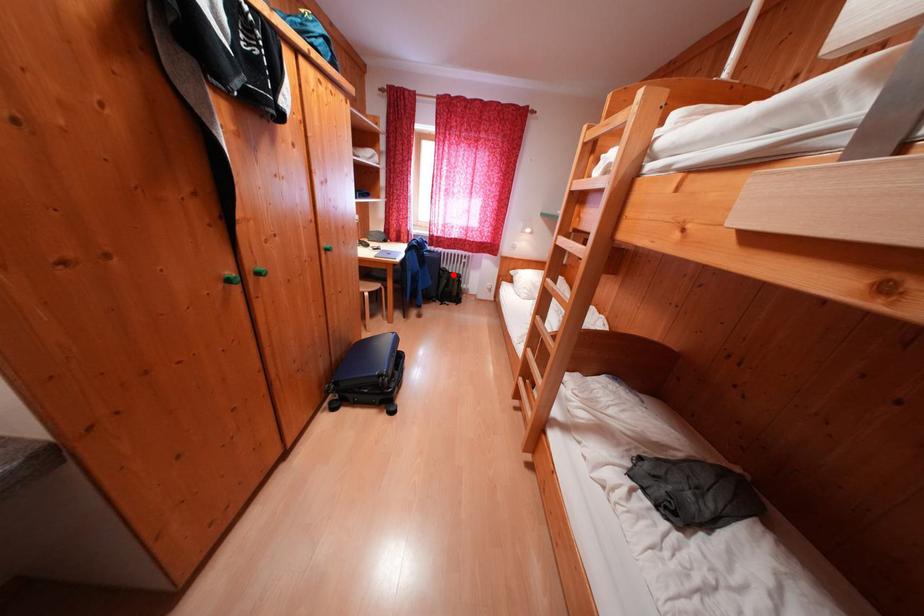
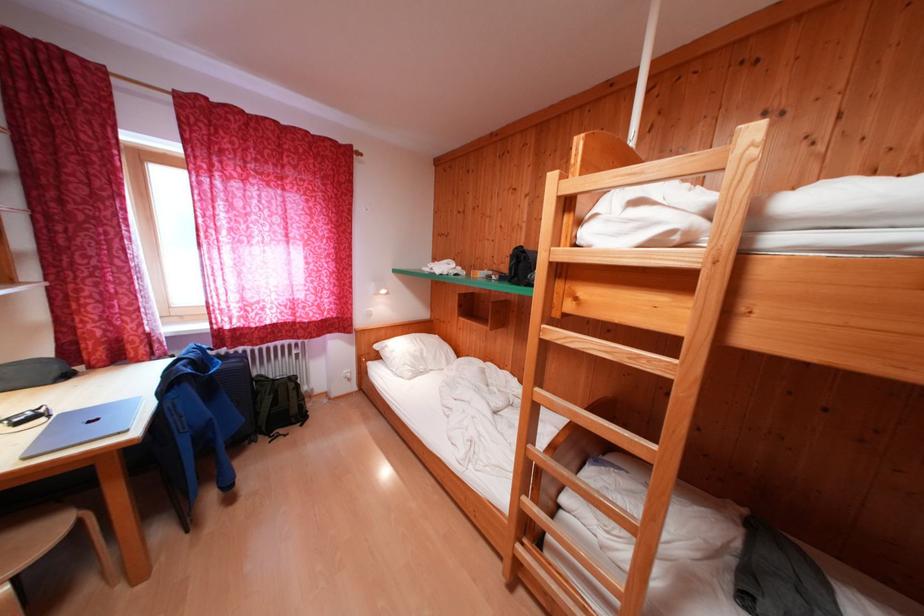
Question: A red point is marked in image1. In image2, is the corresponding 3D point closer to the camera or farther? Reply with the corresponding letter.

Choices:
 (A) The corresponding 3D point is closer.
 (B) The corresponding 3D point is farther.

Answer: (B)